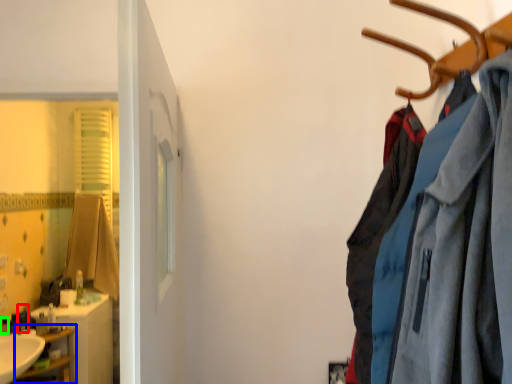
Question: Based on their relative distances, which object is nearer to toiletry (highlighted by a red box)? Choose from shelf (highlighted by a blue box) and toiletry (highlighted by a green box).

Choices:
 (A) shelf
 (B) toiletry

Answer: (B)